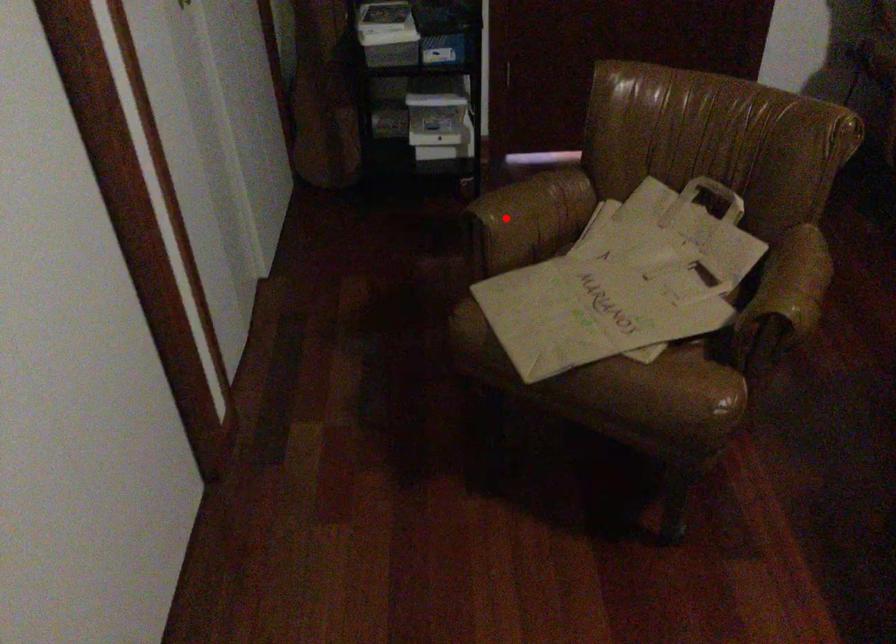
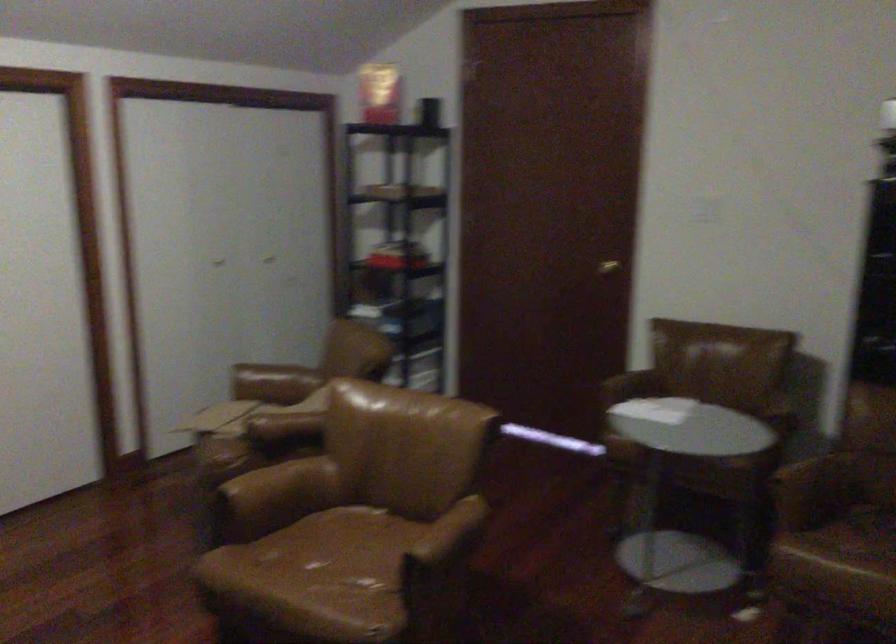
Where in the second image is the point corresponding to the highlighted location from the first image?

(273, 383)